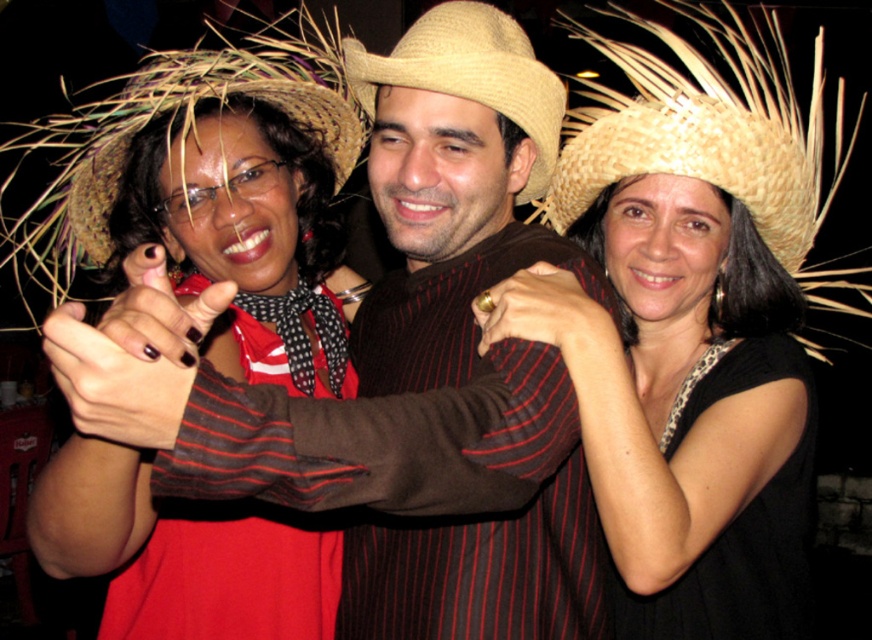
You are a photographer trying to capture a candid shot of both the black matte dress at center and the black knitted dress at right. Since you want to ensure both are in focus, which dress should you focus on first to maximize the chances of both being sharp?

You should focus on the black matte dress at center first because it is closer to the viewer than the black knitted dress at right. By focusing on the closer subject, the farther one may still be within the depth of field, increasing the likelihood of both being sharp.